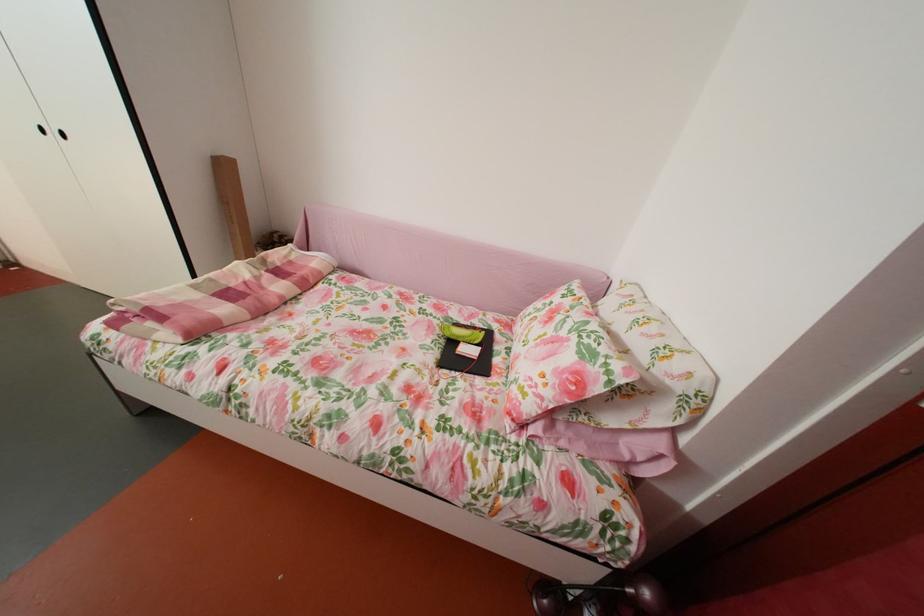
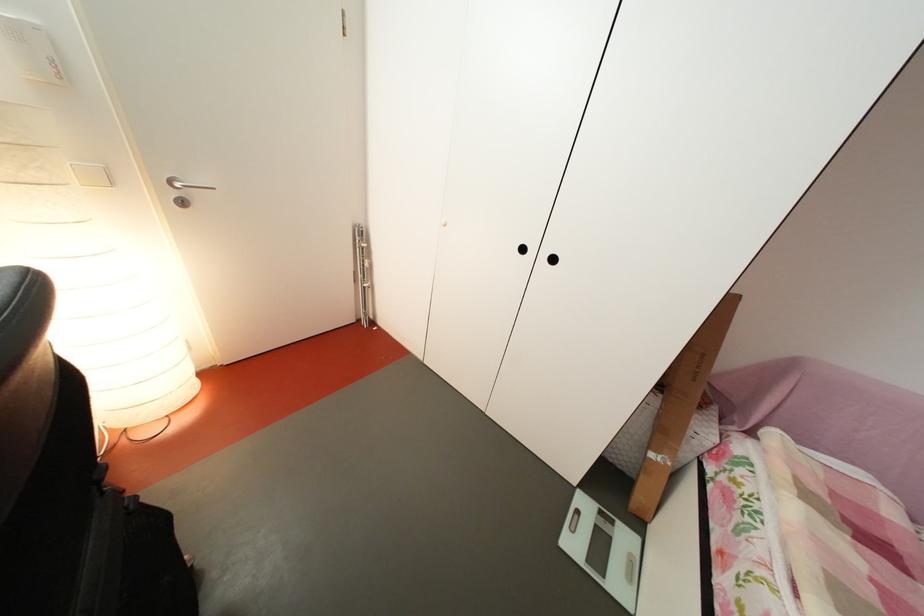
Question: In a continuous first-person perspective shot, in which direction is the camera moving?

Choices:
 (A) Left
 (B) Right
 (C) Forward
 (D) Backward

Answer: (A)